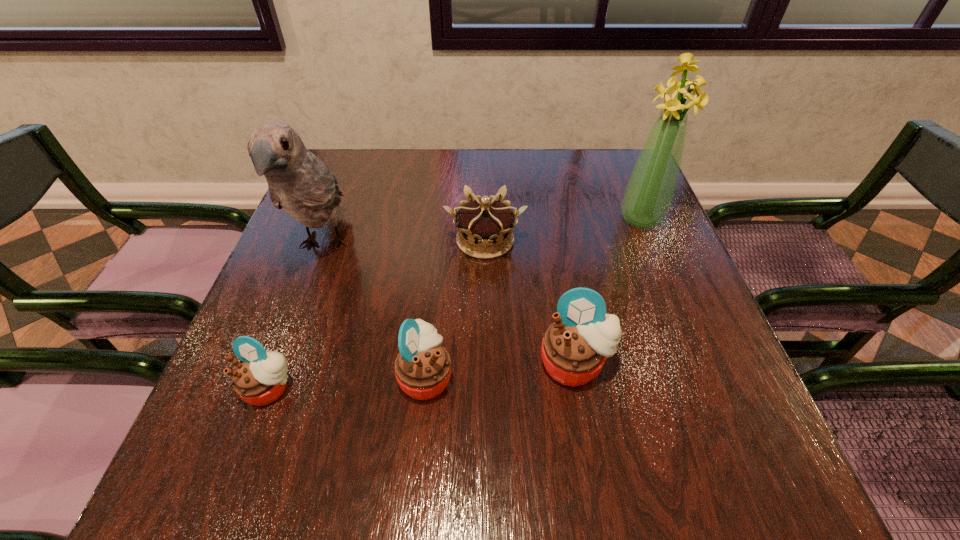
At what (x,y) coordinates should I click in order to perform the action: click on vacant space at the far left corner of the desktop. Please return your answer as a coordinate pair (x, y). This screenshot has height=540, width=960. Looking at the image, I should click on (339, 175).

This screenshot has width=960, height=540. I want to click on blank space at the near right corner of the desktop, so click(651, 399).

You are a GUI agent. You are given a task and a screenshot of the screen. Output one action in this format:
    pyautogui.click(x=<x>, y=<y>)
    Task: Click on the unoccupied area between the bouquet and the crown
    The width and height of the screenshot is (960, 540).
    Given the screenshot: What is the action you would take?
    pyautogui.click(x=563, y=230)

The image size is (960, 540). Find the location of `free space between the second muffin from left to right and the leftmost muffin`. free space between the second muffin from left to right and the leftmost muffin is located at coordinates (x=348, y=382).

Where is `unoccupied area between the crown and the bouquet`? unoccupied area between the crown and the bouquet is located at coordinates (563, 230).

I want to click on empty space between the parrot and the second object from right to left, so click(449, 305).

The width and height of the screenshot is (960, 540). I want to click on vacant area that lies between the second muffin from right to left and the leftmost muffin, so click(x=348, y=382).

Locate an element on the screen. Image resolution: width=960 pixels, height=540 pixels. free space between the fifth object from left to right and the parrot is located at coordinates (449, 305).

The image size is (960, 540). I want to click on free space between the parrot and the leftmost muffin, so click(x=297, y=317).

Image resolution: width=960 pixels, height=540 pixels. I want to click on free area in between the second shortest muffin and the second tallest object, so click(x=374, y=310).